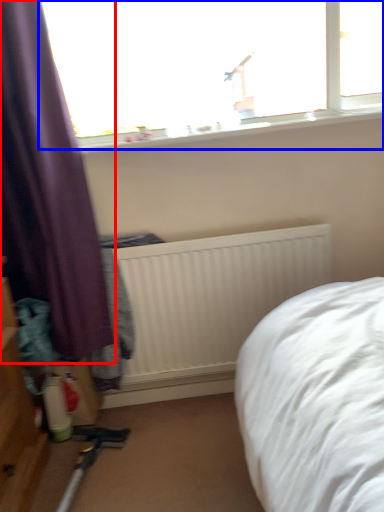
Question: Which object is closer to the camera taking this photo, curtain (highlighted by a red box) or window (highlighted by a blue box)?

Choices:
 (A) curtain
 (B) window

Answer: (A)